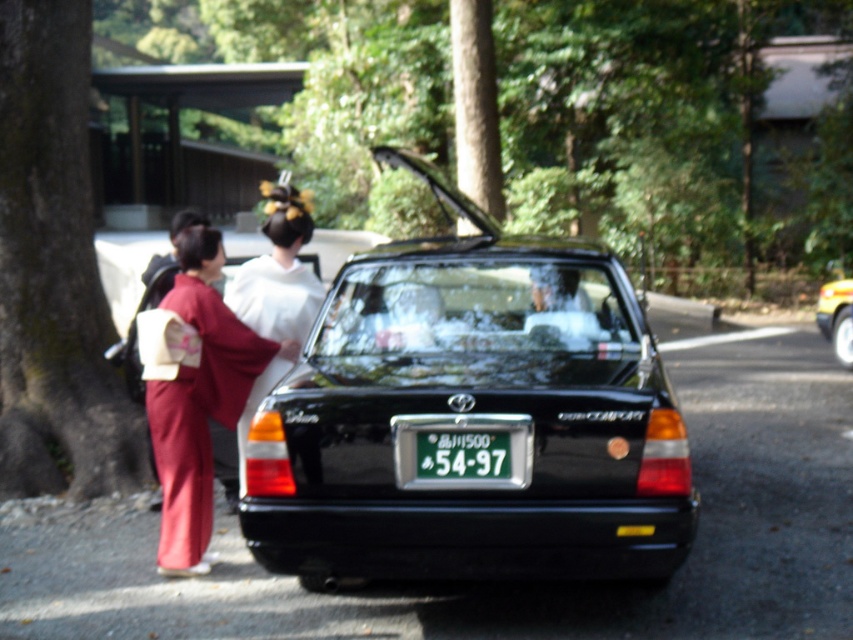
You are organizing a traditional Japanese event and need to arrange seating based on the kimono widths. Since the silky red kimono at left and white silk kimono at center are present, which kimono should be seated in a wider space to accommodate its size?

The silky red kimono at left should be seated in a wider space because its width surpasses that of the white silk kimono at center.

You are standing at a distance of 6 meters from the silky red kimono at left. Can you reach it without moving closer?

The silky red kimono at left is 6.61 meters away from the viewer, so you cannot reach it without moving closer as you are currently 6 meters away.